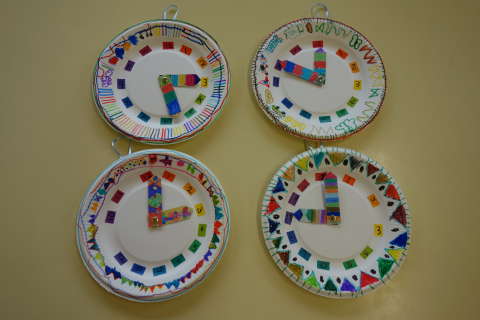
Identify the location of plate clock. (148, 90).